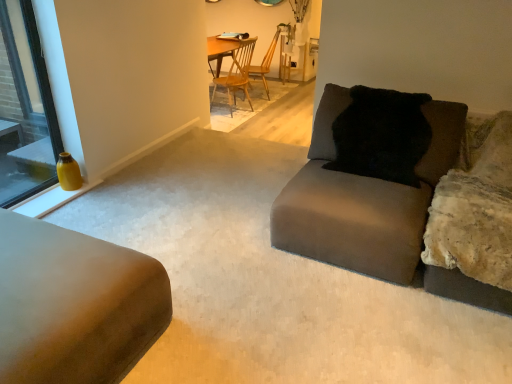
Question: Is wooden chair at center, the second chair from the front, facing towards matte gray couch at center, acting as the 1th studio couch starting from the right?

Choices:
 (A) no
 (B) yes

Answer: (A)

Question: Is wooden chair at center, which appears as the first chair when viewed from the back, thinner than matte gray couch at center, acting as the 1th studio couch starting from the right?

Choices:
 (A) yes
 (B) no

Answer: (A)

Question: Is wooden chair at center, the second chair from the front, beside matte gray couch at center, acting as the 1th studio couch starting from the right?

Choices:
 (A) no
 (B) yes

Answer: (A)

Question: Considering the relative sizes of wooden chair at center, the second chair from the front, and matte gray couch at center, the 2th studio couch positioned from the left, in the image provided, is wooden chair at center, the second chair from the front, bigger than matte gray couch at center, the 2th studio couch positioned from the left,?

Choices:
 (A) no
 (B) yes

Answer: (A)

Question: From the image's perspective, is wooden chair at center, the second chair from the front, beneath matte gray couch at center, the 2th studio couch positioned from the left?

Choices:
 (A) no
 (B) yes

Answer: (A)

Question: In terms of height, does matte yellow vase at left look taller or shorter compared to suede-like beige couch at lower left, which is the 1th studio couch from left to right?

Choices:
 (A) tall
 (B) short

Answer: (A)

Question: From the image's perspective, is matte yellow vase at left above or below suede-like beige couch at lower left, which is counted as the 2th studio couch, starting from the right?

Choices:
 (A) above
 (B) below

Answer: (A)

Question: Considering their positions, is matte yellow vase at left located in front of or behind suede-like beige couch at lower left, which is counted as the 2th studio couch, starting from the right?

Choices:
 (A) behind
 (B) front

Answer: (A)

Question: Considering the positions of matte yellow vase at left and suede-like beige couch at lower left, which is the 1th studio couch from left to right, in the image, is matte yellow vase at left bigger or smaller than suede-like beige couch at lower left, which is the 1th studio couch from left to right,?

Choices:
 (A) small
 (B) big

Answer: (A)

Question: Is matte yellow vase at left inside the boundaries of black fuzzy pillow at upper right, or outside?

Choices:
 (A) outside
 (B) inside

Answer: (A)

Question: Is matte yellow vase at left wider or thinner than black fuzzy pillow at upper right?

Choices:
 (A) thin
 (B) wide

Answer: (A)

Question: In terms of height, does matte yellow vase at left look taller or shorter compared to black fuzzy pillow at upper right?

Choices:
 (A) tall
 (B) short

Answer: (A)

Question: From a real-world perspective, is matte yellow vase at left positioned above or below black fuzzy pillow at upper right?

Choices:
 (A) below
 (B) above

Answer: (B)

Question: Visually, is matte yellow vase at left positioned to the left or to the right of matte gray couch at center, the 2th studio couch positioned from the left?

Choices:
 (A) left
 (B) right

Answer: (A)

Question: Considering the positions of matte yellow vase at left and matte gray couch at center, acting as the 1th studio couch starting from the right, in the image, is matte yellow vase at left taller or shorter than matte gray couch at center, acting as the 1th studio couch starting from the right,?

Choices:
 (A) short
 (B) tall

Answer: (B)